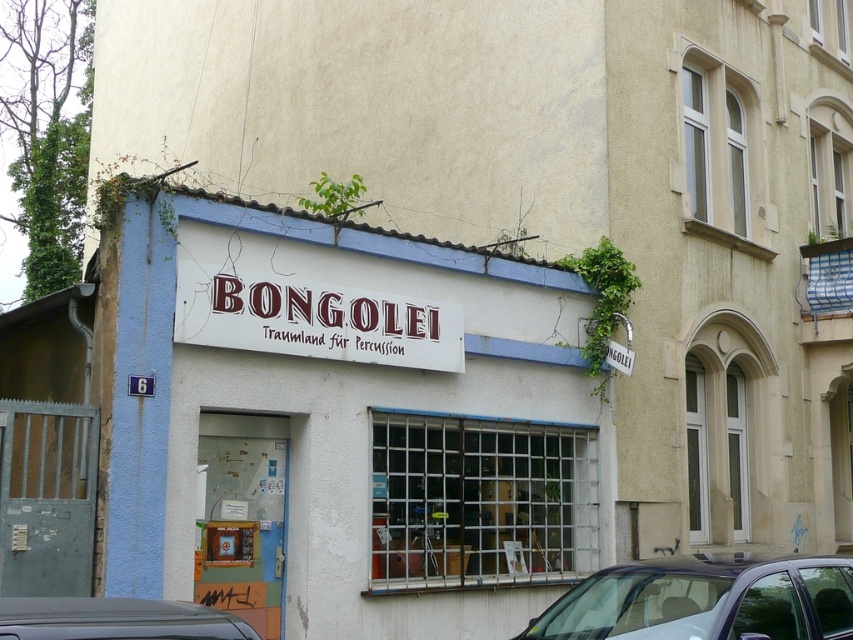
Question: Which object is farther from the camera taking this photo?

Choices:
 (A) metallic silver car at lower right
 (B) metallic gray car at lower left
 (C) white matte signboard at center

Answer: (C)

Question: Which of the following is the farthest from the observer?

Choices:
 (A) white matte signboard at center
 (B) metallic gray car at lower left

Answer: (A)

Question: Is white matte signboard at center smaller than metallic gray car at lower left?

Choices:
 (A) no
 (B) yes

Answer: (A)

Question: Which of the following is the closest to the observer?

Choices:
 (A) (256, 320)
 (B) (44, 618)
 (C) (573, 609)
 (D) (405, 522)

Answer: (B)

Question: Can you confirm if white matte signboard at center is smaller than metallic silver car at lower right?

Choices:
 (A) yes
 (B) no

Answer: (B)

Question: Can you confirm if metallic silver car at lower right is thinner than metallic gray car at lower left?

Choices:
 (A) no
 (B) yes

Answer: (A)